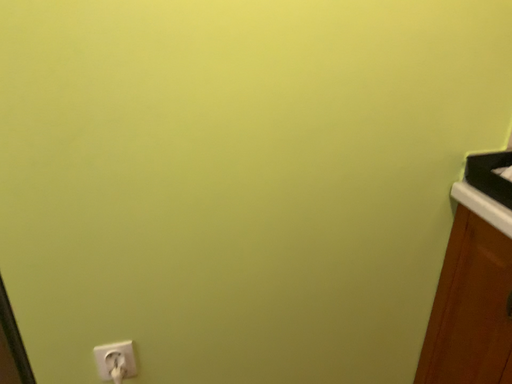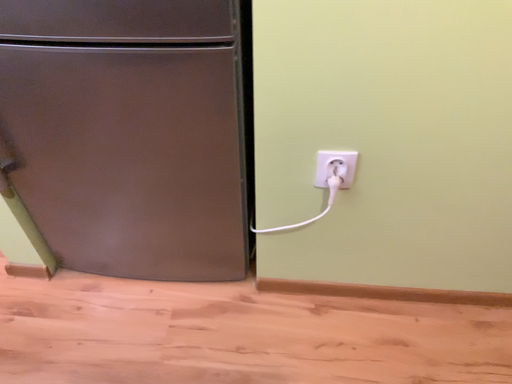
Question: Which way did the camera rotate in the video?

Choices:
 (A) rotated left
 (B) rotated right

Answer: (A)